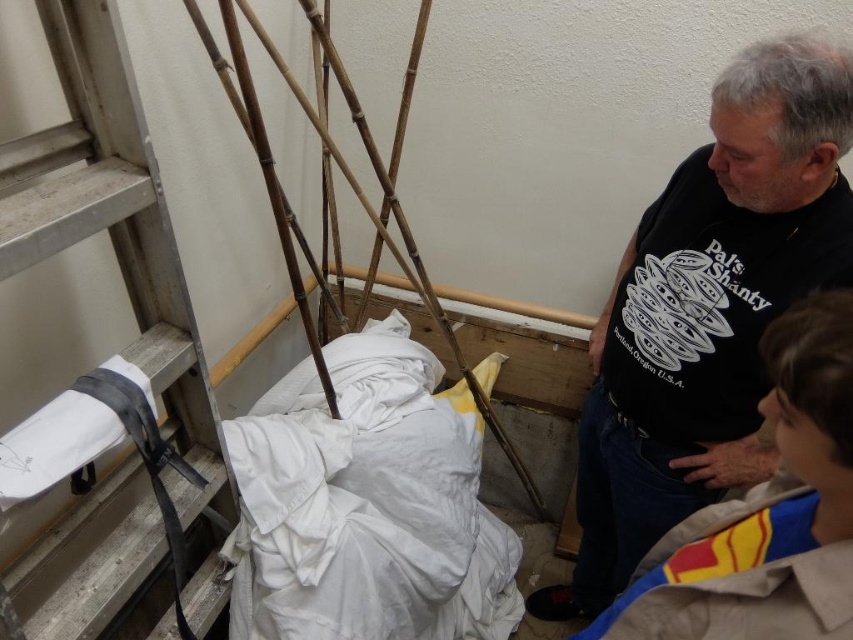
Which is more to the left, white cotton cloth at center or light brown fabric jacket at lower right?

white cotton cloth at center is more to the left.

Who is lower down, white cotton cloth at center or light brown fabric jacket at lower right?

white cotton cloth at center is below.

What are the coordinates of `white cotton cloth at center` in the screenshot? It's located at (366, 506).

Is black t-shirt at upper right above bamboo at left?

No, black t-shirt at upper right is not above bamboo at left.

Based on the photo, which of these two, black t-shirt at upper right or bamboo at left, stands taller?

bamboo at left

Locate an element on the screen. This screenshot has height=640, width=853. black t-shirt at upper right is located at coordinates (706, 308).

Between black t-shirt at upper right and light brown fabric jacket at lower right, which one has more height?

Standing taller between the two is black t-shirt at upper right.

Can you confirm if black t-shirt at upper right is positioned to the left of light brown fabric jacket at lower right?

Incorrect, black t-shirt at upper right is not on the left side of light brown fabric jacket at lower right.

Measure the distance between point [769,252] and camera.

A distance of 1.14 meters exists between point [769,252] and camera.

You are a GUI agent. You are given a task and a screenshot of the screen. Output one action in this format:
    pyautogui.click(x=<x>, y=<y>)
    Task: Click on the black t-shirt at upper right
    
    Given the screenshot: What is the action you would take?
    pyautogui.click(x=706, y=308)